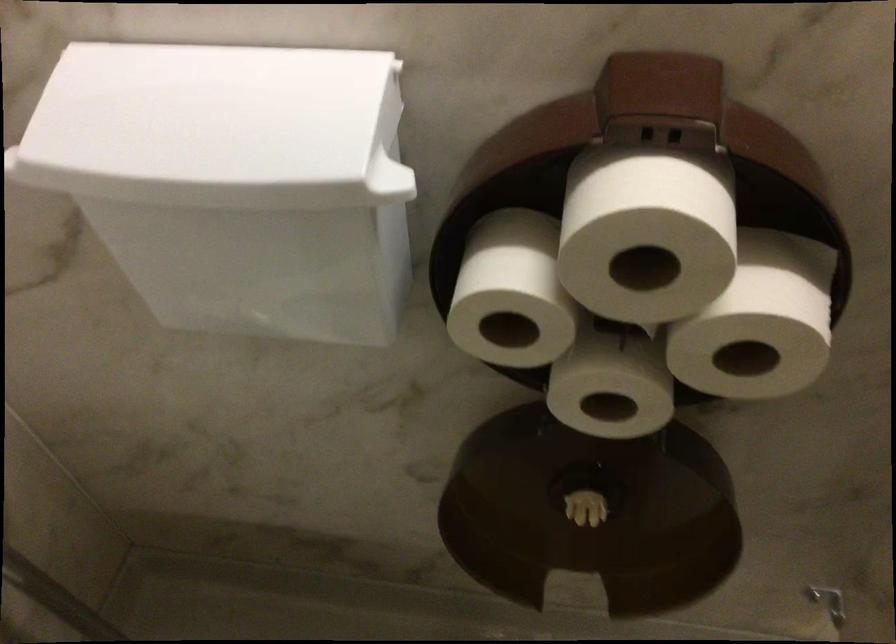
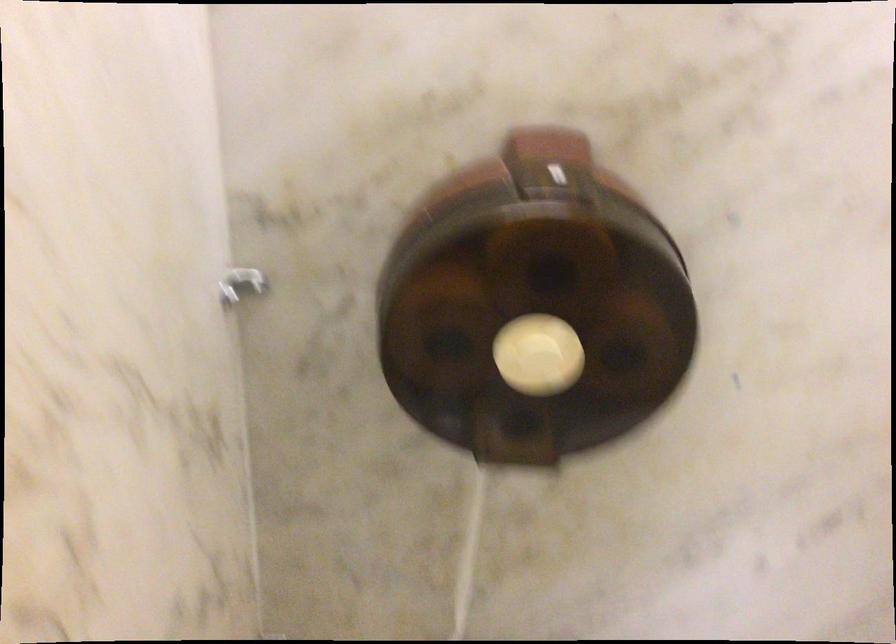
What movement of the cameraman would produce the second image?

The movement direction of the cameraman is right, backward.